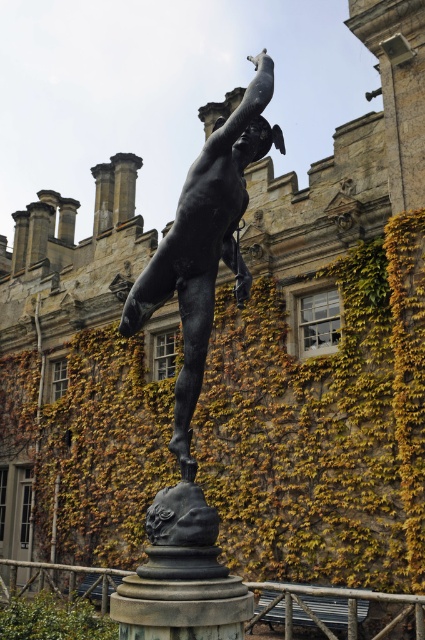
Question: Can you confirm if green ivy at center is positioned above bronze statue at center?

Choices:
 (A) no
 (B) yes

Answer: (A)

Question: Does green ivy at center have a smaller size compared to bronze statue at center?

Choices:
 (A) no
 (B) yes

Answer: (B)

Question: Which object is closer to the camera taking this photo?

Choices:
 (A) bronze statue at center
 (B) green ivy at center

Answer: (A)

Question: Can you confirm if green ivy at center is positioned to the right of bronze statue at center?

Choices:
 (A) no
 (B) yes

Answer: (A)